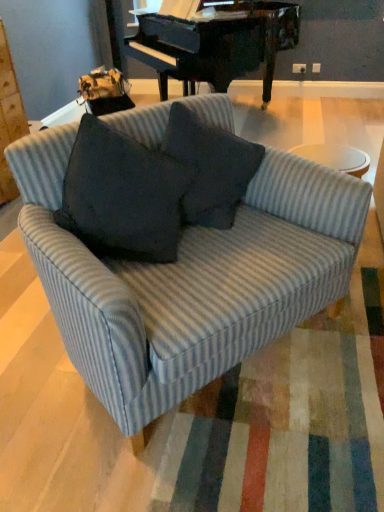
Question: From a real-world perspective, relative to gray corduroy throw pillow at center, is striped fabric couch at center vertically above or below?

Choices:
 (A) above
 (B) below

Answer: (B)

Question: Based on their positions, is striped fabric couch at center located to the left or right of gray corduroy throw pillow at center?

Choices:
 (A) right
 (B) left

Answer: (B)

Question: In the image, is striped fabric couch at center positioned in front of or behind gray corduroy throw pillow at center?

Choices:
 (A) behind
 (B) front

Answer: (B)

Question: Considering their positions, is gray corduroy throw pillow at center located in front of or behind striped fabric couch at center?

Choices:
 (A) behind
 (B) front

Answer: (A)

Question: From a real-world perspective, relative to striped fabric couch at center, is gray corduroy throw pillow at center vertically above or below?

Choices:
 (A) above
 (B) below

Answer: (A)

Question: Would you say gray corduroy throw pillow at center is to the left or to the right of striped fabric couch at center in the picture?

Choices:
 (A) right
 (B) left

Answer: (A)

Question: In terms of width, does gray corduroy throw pillow at center look wider or thinner when compared to striped fabric couch at center?

Choices:
 (A) thin
 (B) wide

Answer: (A)